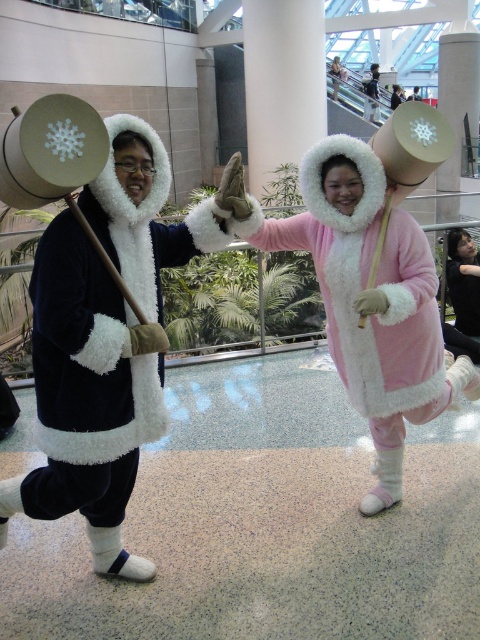
You are a photographer trying to capture a photo of the two performers. You notice a point at coordinates (368, 298). Based on the scene description, what object is located at this point?

The point at coordinates (368, 298) marks the location of the matte pink plush coat at center.

Looking at this image, you are standing in front of the two costumed individuals holding large round objects. You want to take a photo that captures both of them clearly. The camera you are using has a focus range of 5 feet to 6 feet. Is the point at coordinates point (x=71, y=214) within the camera focus range?

The point point (x=71, y=214) is 5.96 feet from the viewer, which is within the camera focus range of 5 feet to 6 feet. Therefore, the camera can focus on that point.

You are a costume designer trying to fit a new coat over the velvet black coat at left and the matte pink plush coat at center. The new coat needs to be 10 cm wider than the widest coat. What is the minimum width the new coat should be?

The matte pink plush coat at center is wider than the velvet black coat at left. Therefore, the new coat must be at least 10 cm wider than the matte pink plush coat at center to fit over both. Since the exact width of the matte pink plush coat at center isn not provided, we cannot determine the exact minimum width required.